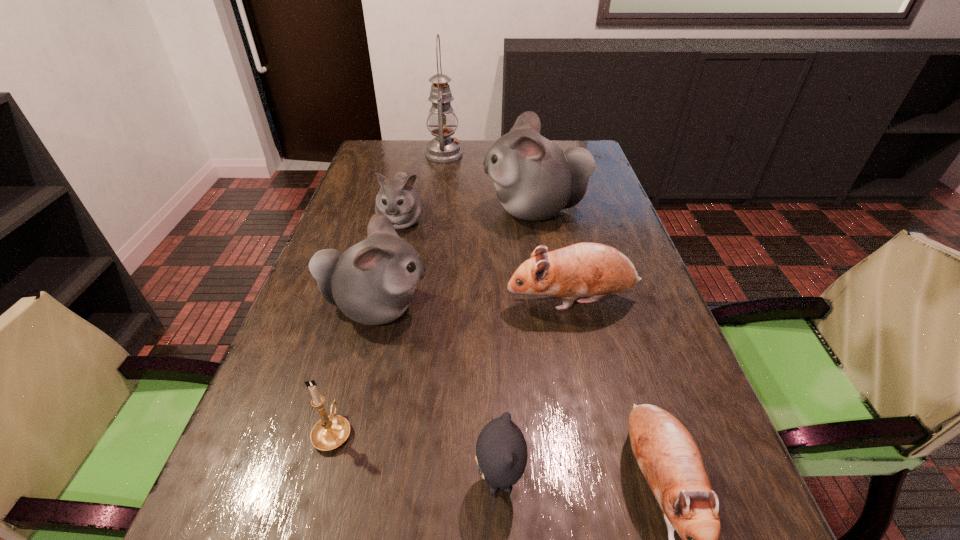
Select which brown hamster is the closest to the gold candle holder. Please provide its 2D coordinates. Your answer should be formatted as a tuple, i.e. [(x, y)], where the tuple contains the x and y coordinates of a point satisfying the conditions above.

[(584, 269)]

The height and width of the screenshot is (540, 960). In order to click on free space that satisfies the following two spatial constraints: 1. on the face of the smallest white hamster; 2. on the face of the nearest white hamster in this screenshot , I will do `click(380, 308)`.

Where is `vacant space that satisfies the following two spatial constraints: 1. on the face of the smallest white hamster; 2. on the face of the second smallest white hamster`? The height and width of the screenshot is (540, 960). vacant space that satisfies the following two spatial constraints: 1. on the face of the smallest white hamster; 2. on the face of the second smallest white hamster is located at coordinates (380, 308).